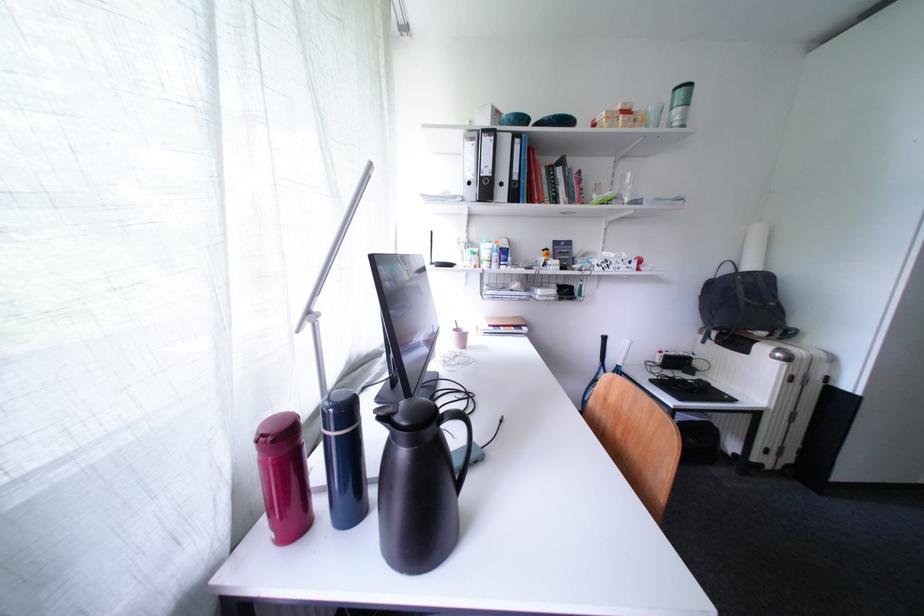
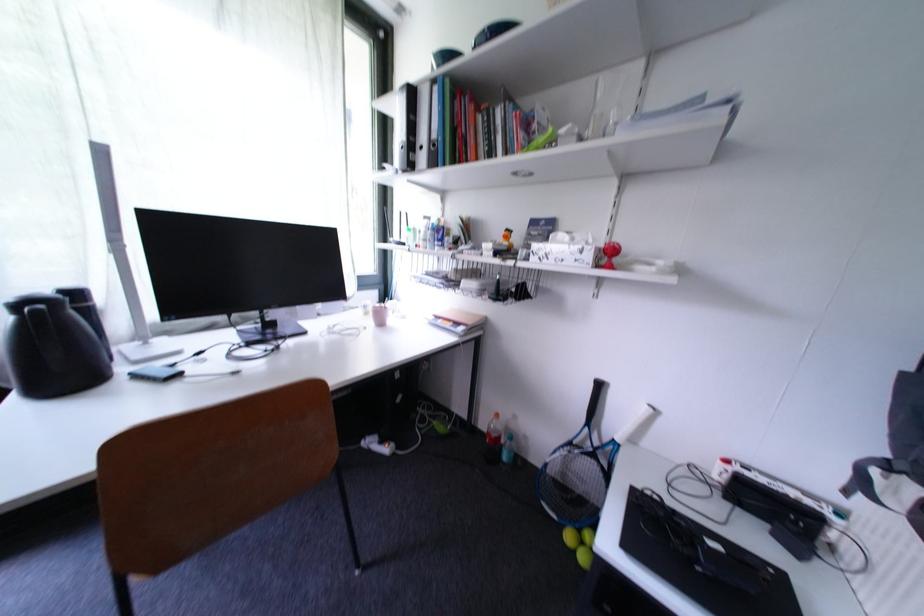
Find the pixel in the second image that matches pixel 638 265 in the first image.

(590, 253)